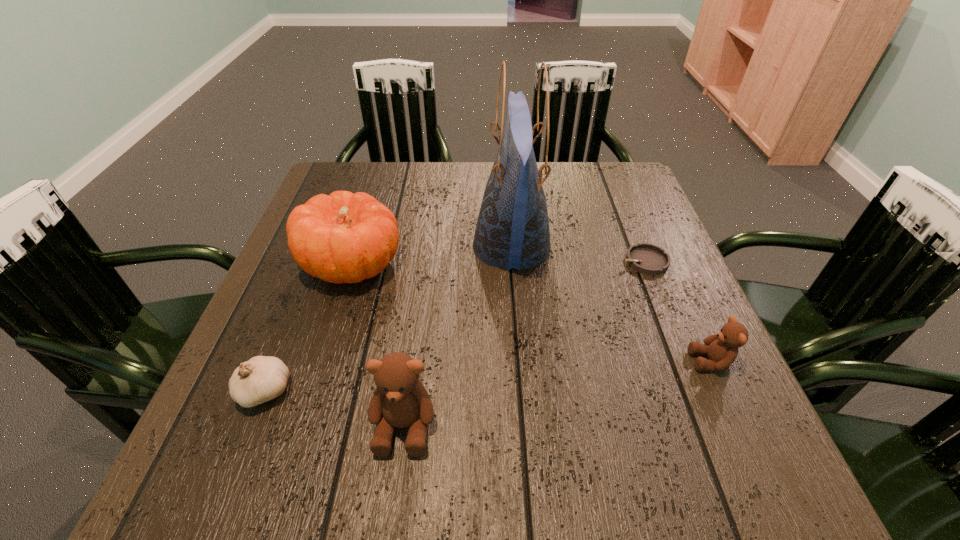
Please point a location where one more teddy_bear can be added evenly. Please provide its 2D coordinates. Your answer should be formatted as a tuple, i.e. [(x, y)], where the tuple contains the x and y coordinates of a point satisfying the conditions above.

[(566, 392)]